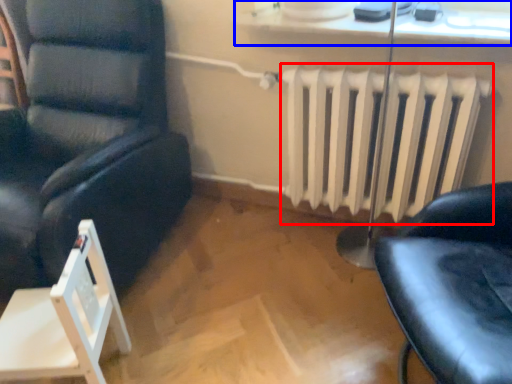
Question: Which point is closer to the camera, radiator (highlighted by a red box) or window sill (highlighted by a blue box)?

Choices:
 (A) radiator
 (B) window sill

Answer: (B)